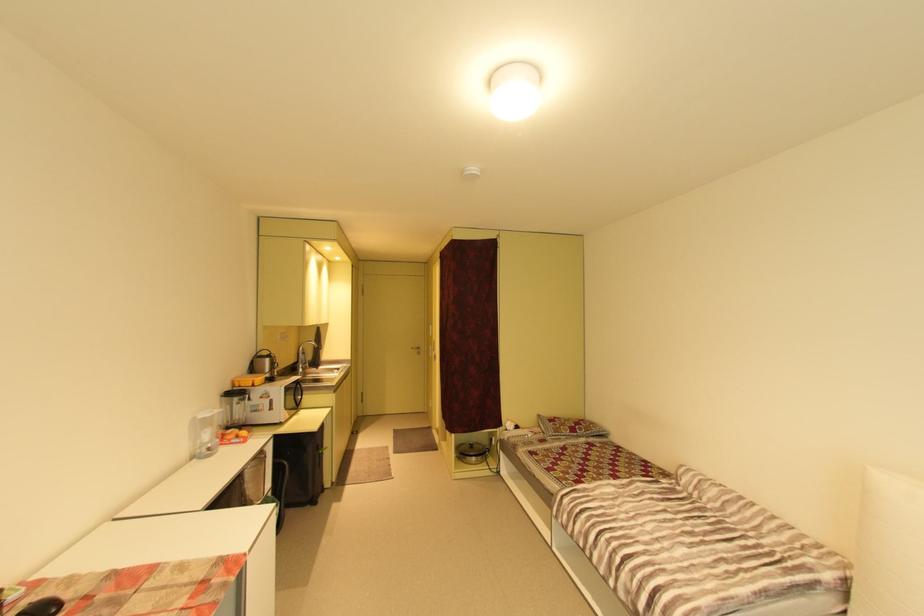
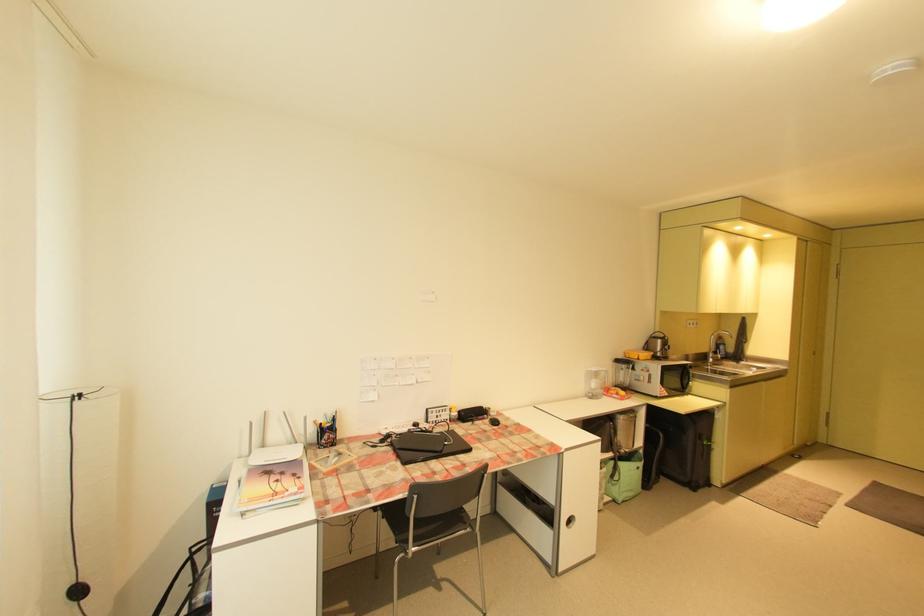
Find the pixel in the second image that matches pixel 228 411 in the first image.

(613, 371)